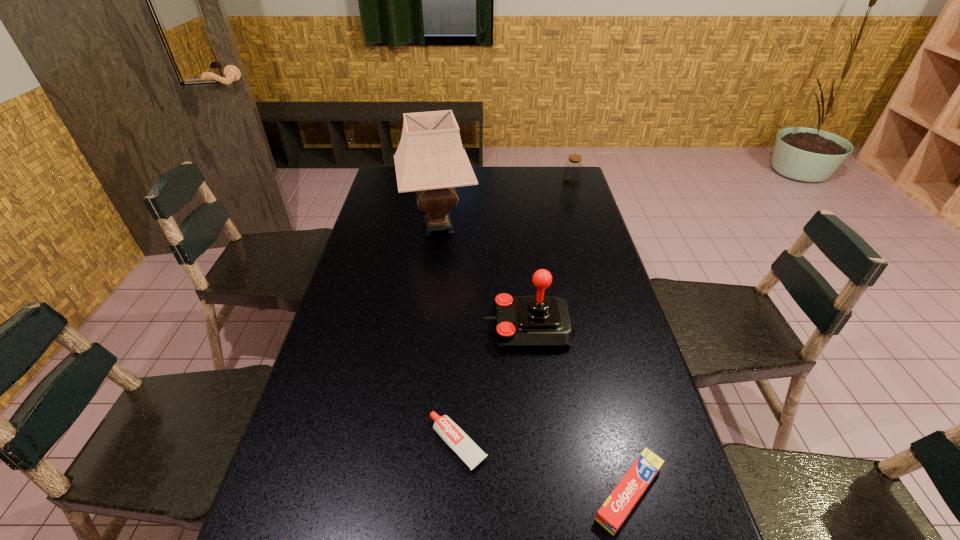
Find the location of a particular element. The height and width of the screenshot is (540, 960). free space at the left edge of the desktop is located at coordinates pos(309,409).

Locate an element on the screen. The height and width of the screenshot is (540, 960). blank space at the far left corner of the desktop is located at coordinates click(x=378, y=180).

Where is `free space at the far right corner`? The width and height of the screenshot is (960, 540). free space at the far right corner is located at coordinates (561, 188).

The width and height of the screenshot is (960, 540). Identify the location of vacant area that lies between the joystick and the fifth nearest object. (483, 277).

Locate an element on the screen. Image resolution: width=960 pixels, height=540 pixels. free space between the right toothpaste and the left toothpaste is located at coordinates (543, 468).

Locate an element on the screen. The width and height of the screenshot is (960, 540). free spot between the right toothpaste and the farthest object is located at coordinates (600, 338).

Find the location of a particular element. The height and width of the screenshot is (540, 960). vacant region between the fourth nearest object and the jar is located at coordinates (549, 256).

Where is `the second closest object to the shortest object`? the second closest object to the shortest object is located at coordinates (614, 511).

In order to click on object that is the second closest to the right toothpaste in this screenshot , I will do `click(526, 322)`.

This screenshot has height=540, width=960. What are the coordinates of `free spot that satisfies the following two spatial constraints: 1. on the base of the right toothpaste; 2. on the right side of the fifth shortest object` in the screenshot? It's located at (545, 493).